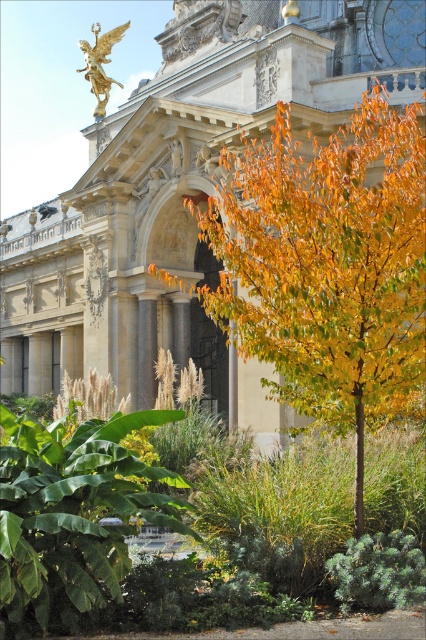
You are an architect analyzing the symmetry of the beige stone palace at center and the gold polished statue at upper center. Based on their positions, which object is positioned to the right of the other?

The beige stone palace at center is to the right of the gold polished statue at upper center, so the palace is positioned to the right of the statue.

You are a drone operator tasked with capturing aerial footage of the classical architectural structure. Your drone has a maximum flight range of 40 meters. If you are positioned near the golden yellow leaves at center, can you fly your drone to the gold polished statue at upper center without exceeding its range?

The distance between the golden yellow leaves at center and the gold polished statue at upper center is 37.08 meters, which is within the drone operator maximum flight range of 40 meters. Therefore, the drone can safely fly to the gold polished statue at upper center without exceeding its range.

You are an architect planning to install a large decorative fountain in the garden. The fountain requires a space wider than the golden yellow leaves at center. Can the beige stone palace at center provide enough space for the fountain?

The beige stone palace at center is wider than the golden yellow leaves at center, so yes, the beige stone palace at center can provide enough space for the fountain since its width is greater than the required space.